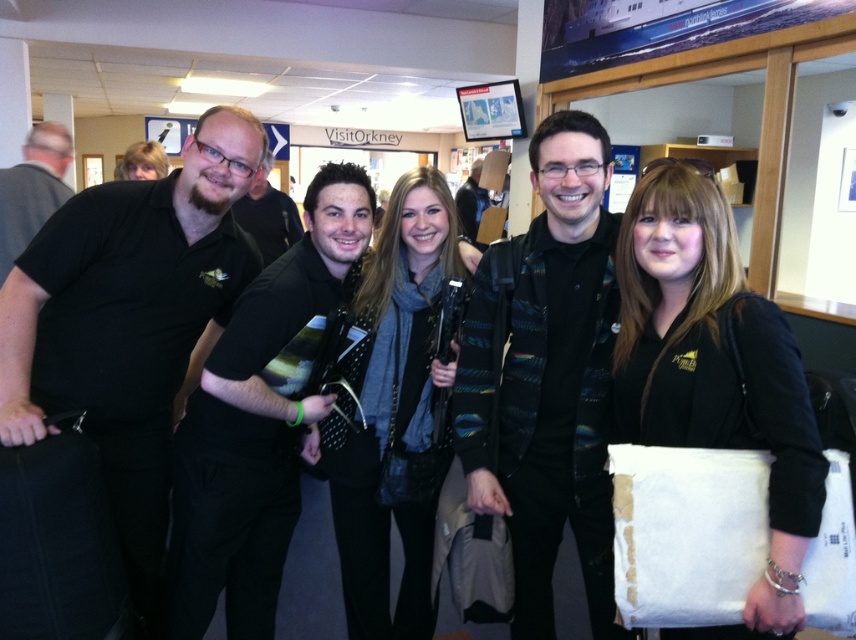
You are a photographer taking a group photo and want to ensure that the black matte shirt at left and the patterned sweater at center are both visible. Based on their positions, which person should you adjust to make sure both are fully visible?

The black matte shirt at left is in front of the patterned sweater at center. To ensure both are fully visible, you should move the black matte shirt at left slightly backward so it doesn not block the patterned sweater at center.

Based on the scene description, where is the black matte shirt at left located in terms of its 2D coordinates?

The black matte shirt at left is located at the 2D coordinates of point [129,323].

You are a photographer trying to capture a clear shot of both the black matte shirt at left and the patterned sweater at center. Since you want both subjects to appear equally prominent in the photo, which adjustment should you make based on their sizes?

The black matte shirt at left is bigger than the patterned sweater at center. To make them appear equally prominent, you should move closer to the patterned sweater at center or farther from the black matte shirt at left to balance their sizes in the frame.